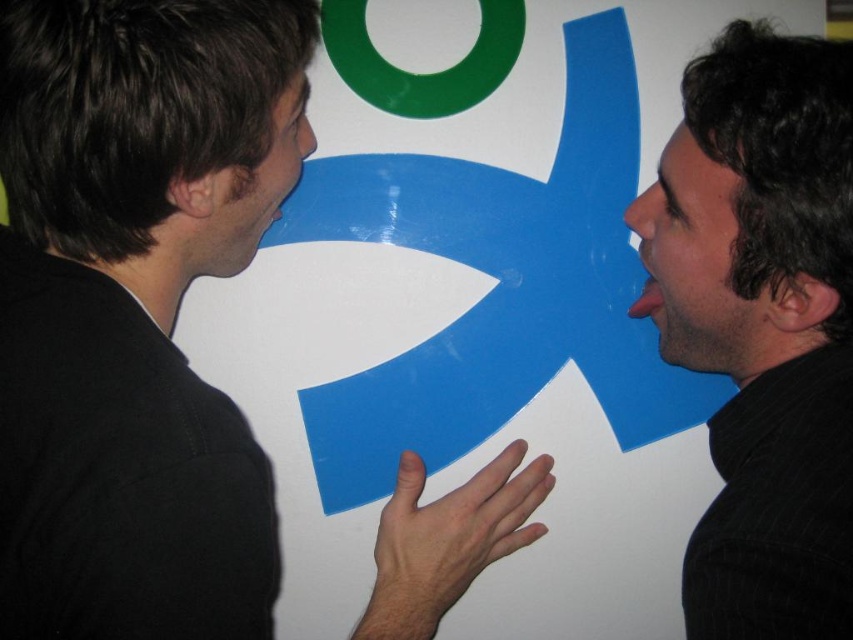
You are a photographer trying to capture a candid shot of the two people in the scene. You want to ensure that both the black matte shirt at left and the black textured hair at right are clearly visible in the frame. Based on their positions, which object should you focus on first to ensure both are in focus?

The black matte shirt at left is positioned on the left side of black textured hair at right. Since they are close to each other, focusing on either one should keep both in focus, but prioritizing the black matte shirt at left might help ensure the black textured hair at right is also sharp due to their proximity.

You are a photographer trying to capture a candid shot of the two people in the scene. You want to ensure that the black matte shirt at left is clearly visible in the frame. Given that the camera is focused on the point at coordinates point (135,308), will this focus point help in capturing the black matte shirt at left?

Yes, the focus point at coordinates point (135,308) corresponds to the black matte shirt at left, so focusing there will ensure the black matte shirt at left is clearly visible.

From the picture: You are a fashion designer observing the scene. You need to decide which item, the black matte shirt at left or the black textured hair at right, would require more fabric to create a replica. Which one would it be?

The black matte shirt at left is larger in size than the black textured hair at right, so the black matte shirt at left would require more fabric to create a replica.